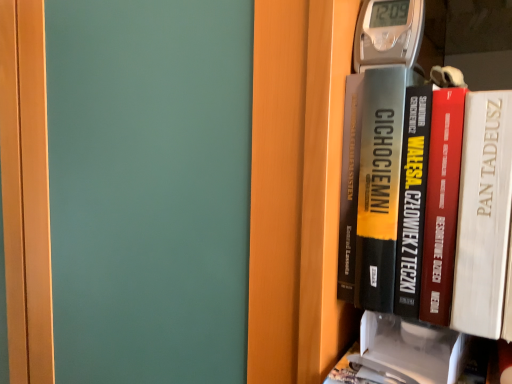
In order to face black matte book at right, should I rotate leftwards or rightwards?

Turn right approximately 22.425 degrees to face it.

What do you see at coordinates (426, 199) in the screenshot? I see `black matte book at right` at bounding box center [426, 199].

This screenshot has height=384, width=512. Identify the location of black matte book at right. (426, 199).

Find the location of a particular element. This screenshot has width=512, height=384. black matte book at right is located at coordinates [426, 199].